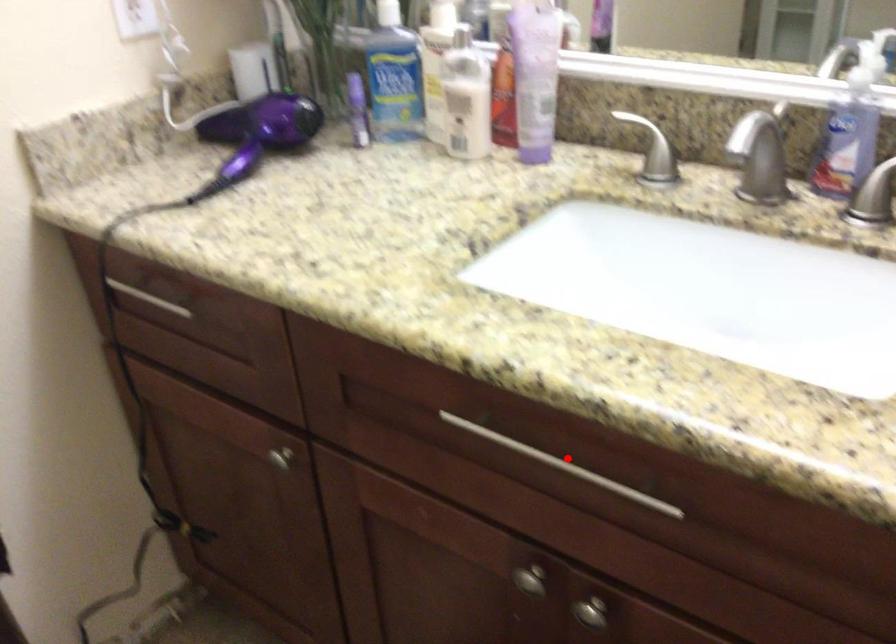
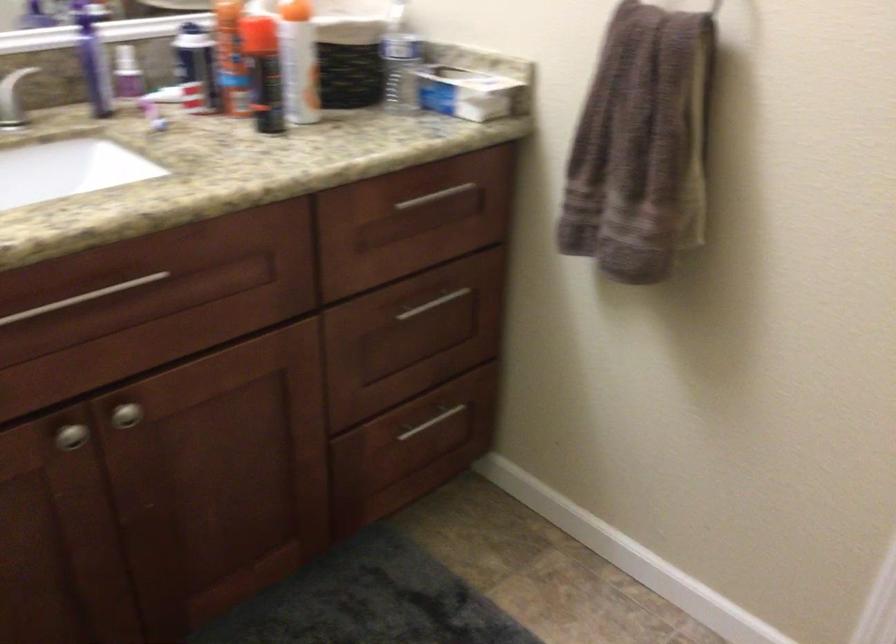
Question: I am providing you with two images of the same scene from different viewpoints. In image1, a red point is highlighted. Considering the same 3D point in image2, which of the following is correct?

Choices:
 (A) It is closer
 (B) It is farther

Answer: (B)